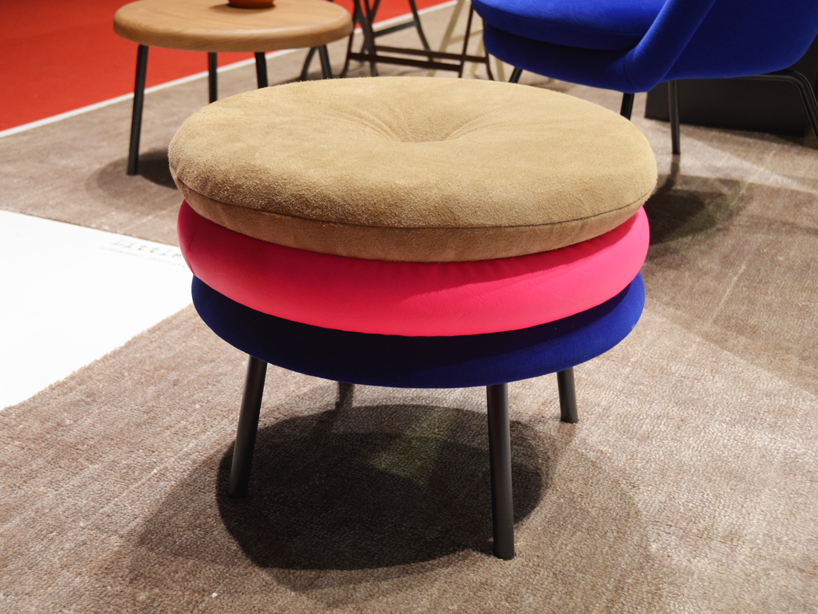
You are a GUI agent. You are given a task and a screenshot of the screen. Output one action in this format:
    pyautogui.click(x=<x>, y=<y>)
    Task: Click on the rug
    
    Given the screenshot: What is the action you would take?
    pyautogui.click(x=123, y=196)